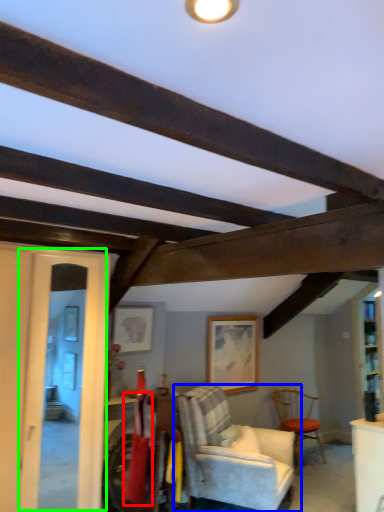
Question: Which is farther away from laundry (highlighted by a red box)? chair (highlighted by a blue box) or glass door (highlighted by a green box)?

Choices:
 (A) chair
 (B) glass door

Answer: (A)